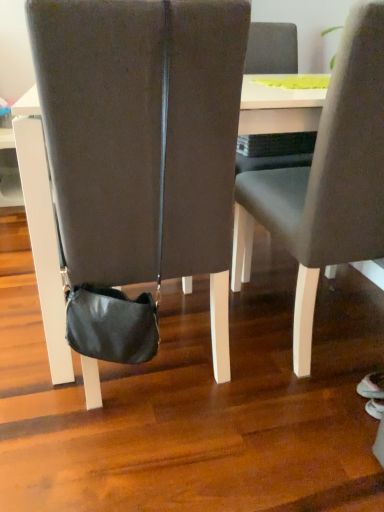
The height and width of the screenshot is (512, 384). I want to click on free space in front of matte gray chair at center, the second chair positioned from the left, so click(283, 431).